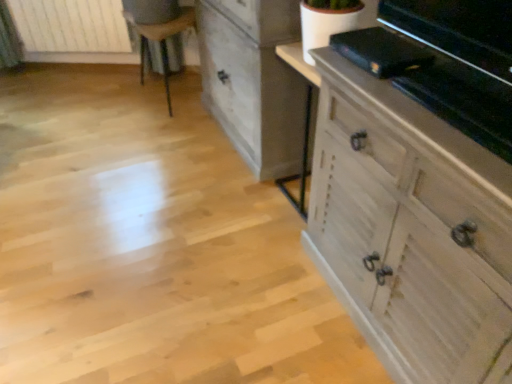
Question: Considering their positions, is white wooden radiator at upper left located in front of or behind distressed white chest of drawers at center, which is the 1th chest of drawers in back-to-front order?

Choices:
 (A) behind
 (B) front

Answer: (A)

Question: In terms of size, does white wooden radiator at upper left appear bigger or smaller than distressed white chest of drawers at center, which is counted as the second chest of drawers, starting from the front?

Choices:
 (A) small
 (B) big

Answer: (A)

Question: Which object is the closest to the distressed white chest of drawers at center, which is the 1th chest of drawers in back-to-front order?

Choices:
 (A) white wood chest of drawers at right, the second chest of drawers positioned from the back
 (B) wooden chair at upper left
 (C) white wooden radiator at upper left

Answer: (B)

Question: Which is nearer to the white wood chest of drawers at right, which ranks as the 1th chest of drawers in front-to-back order?

Choices:
 (A) white wooden radiator at upper left
 (B) distressed white chest of drawers at center, which is counted as the second chest of drawers, starting from the front
 (C) wooden chair at upper left

Answer: (B)